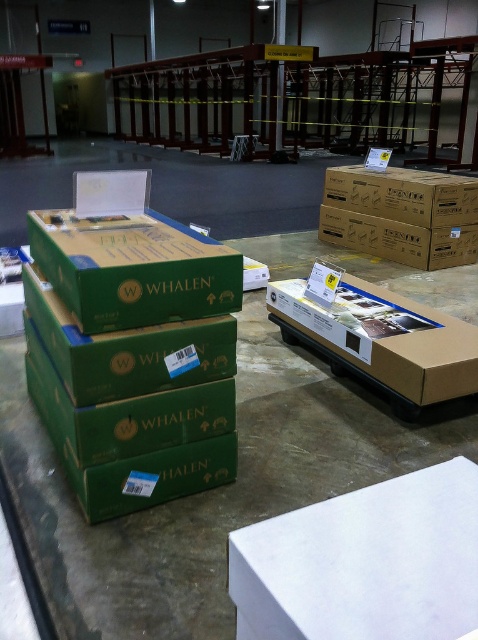
You are standing in the warehouse and want to pick up the item at point (437, 348). Your arm can reach up to 2 meters. Can you reach it?

The point (437, 348) is 2.08 meters away from you, so your arm cannot reach it since it can only extend up to 2 meters.

You are a warehouse worker who needs to place a new box on the pallet. The new box must be placed to the right of the green cardboard box at center. Can you confirm the coordinates where you should place the new box?

The green cardboard box at center is located at point (131, 346). To place the new box to the right of it, you should position it at coordinates higher than 0.542 on the x axis while maintaining the same y coordinate of 0.276.

You are standing in the warehouse and need to reach a specific point marked at coordinates point [54,412]. If your arm can extend 1.5 meters, can you reach that point without moving closer?

The point [54,412] is 1.77 meters away from the camera, so no, you cannot reach it with an arm that extends only 1.5 meters. You need to move closer.